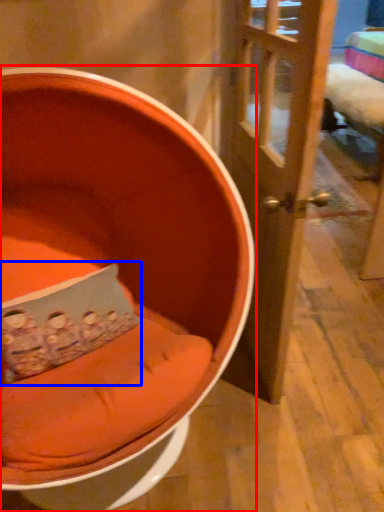
Question: Which object appears farthest to the camera in this image, chair (highlighted by a red box) or pillow (highlighted by a blue box)?

Choices:
 (A) chair
 (B) pillow

Answer: (B)